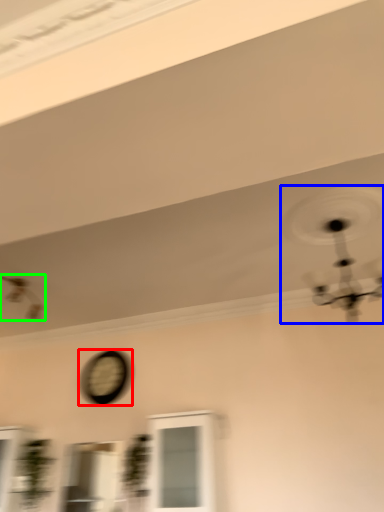
Question: Which object is the farthest from clock (highlighted by a red box)? Choose among these: mechanical fan (highlighted by a blue box) or mechanical fan (highlighted by a green box).

Choices:
 (A) mechanical fan
 (B) mechanical fan

Answer: (A)